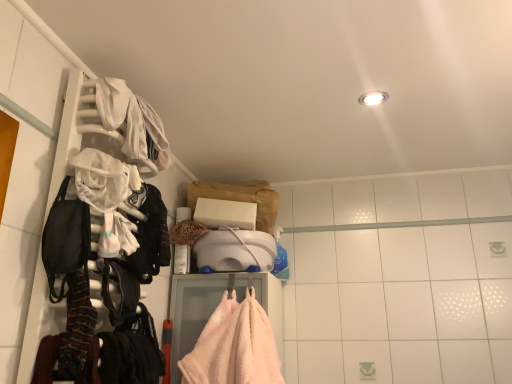
Question: Is white fabric at upper left, the 2th clothing in the front-to-back sequence, wider than striped wool scarf at left, which is the 2th clothing from top to bottom?

Choices:
 (A) no
 (B) yes

Answer: (B)

Question: Considering the relative sizes of white fabric at upper left, the 2th clothing in the front-to-back sequence, and striped wool scarf at left, the first clothing ordered from the bottom, in the image provided, is white fabric at upper left, the 2th clothing in the front-to-back sequence, smaller than striped wool scarf at left, the first clothing ordered from the bottom,?

Choices:
 (A) no
 (B) yes

Answer: (A)

Question: From a real-world perspective, is white fabric at upper left, the 2th clothing when ordered from bottom to top, under striped wool scarf at left, the first clothing ordered from the bottom?

Choices:
 (A) no
 (B) yes

Answer: (A)

Question: Is white fabric at upper left, the 2th clothing when ordered from bottom to top, positioned in front of striped wool scarf at left, the second clothing when ordered from back to front?

Choices:
 (A) yes
 (B) no

Answer: (B)

Question: Is striped wool scarf at left, the second clothing when ordered from back to front, a part of white fabric at upper left, the 2th clothing in the front-to-back sequence?

Choices:
 (A) yes
 (B) no

Answer: (B)

Question: From a real-world perspective, is white fabric at upper left, arranged as the first clothing when viewed from the back, physically above striped wool scarf at left, the second clothing when ordered from back to front?

Choices:
 (A) no
 (B) yes

Answer: (B)

Question: Can you confirm if white fabric at upper left, arranged as the first clothing when viewed from the back, is thinner than black fabric backpack at left?

Choices:
 (A) no
 (B) yes

Answer: (B)

Question: Is white fabric at upper left, the 2th clothing when ordered from bottom to top, further to the viewer compared to black fabric backpack at left?

Choices:
 (A) yes
 (B) no

Answer: (A)

Question: Does white fabric at upper left, marked as the first clothing in a top-to-bottom arrangement, come in front of black fabric backpack at left?

Choices:
 (A) no
 (B) yes

Answer: (A)

Question: Could you tell me if white fabric at upper left, the 2th clothing in the front-to-back sequence, is turned towards black fabric backpack at left?

Choices:
 (A) yes
 (B) no

Answer: (B)

Question: Does white fabric at upper left, marked as the first clothing in a top-to-bottom arrangement, have a greater height compared to black fabric backpack at left?

Choices:
 (A) yes
 (B) no

Answer: (B)

Question: From a real-world perspective, is white fabric at upper left, marked as the first clothing in a top-to-bottom arrangement, positioned under black fabric backpack at left based on gravity?

Choices:
 (A) no
 (B) yes

Answer: (A)

Question: Is black fabric backpack at left oriented towards white fabric at upper left, arranged as the first clothing when viewed from the back?

Choices:
 (A) yes
 (B) no

Answer: (B)